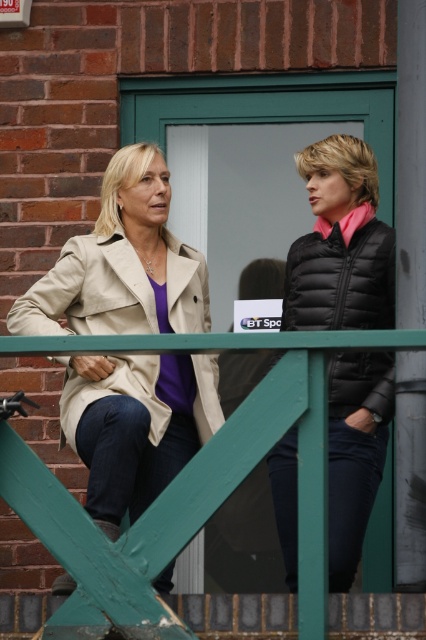
You are a photographer trying to capture a photo of both the black puffer jacket at upper right and the black quilted vest at right in the same frame. The camera you are using has a maximum zoom of 10x. Given that the minimum distance required to fit both objects in the frame is 3.5 inches, can you take the photo without moving closer?

The distance between the black puffer jacket at upper right and the black quilted vest at right is 4.06 inches. Since the minimum required distance is 3.5 inches, the photographer would need to move closer to reduce the distance to within the camera limit. Therefore, the photo cannot be taken without moving closer.

In the scene shown: You are standing in front of the green metal railing and want to reach both the point at coordinates point (x=340, y=198) and point (x=293, y=284). Which point should you move towards first to reach the closer one first?

Point (x=340, y=198) is closer to the viewer than point (x=293, y=284), so you should move towards point (x=340, y=198) first.

Based on the photo, you are standing in front of the brick wall with the two people talking. You want to place a small potted plant exactly at the point marked as point (330, 508). Considering the green metal railing in front of you, will the plant be visible from your current position?

The point (330, 508) is 28.11 feet away from the viewer. Since the green metal railing is in the foreground and partially obscures the view, the plant placed at this point may be partially or fully hidden depending on the railing height and distance. However, since the distance is significant, the plant might still be visible beyond the railing.